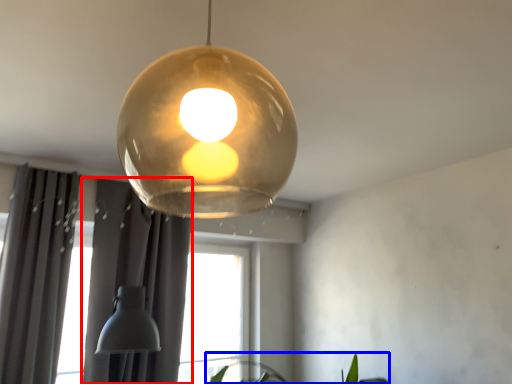
Question: Among these objects, which one is nearest to the camera, curtain (highlighted by a red box) or plant (highlighted by a blue box)?

Choices:
 (A) curtain
 (B) plant

Answer: (B)